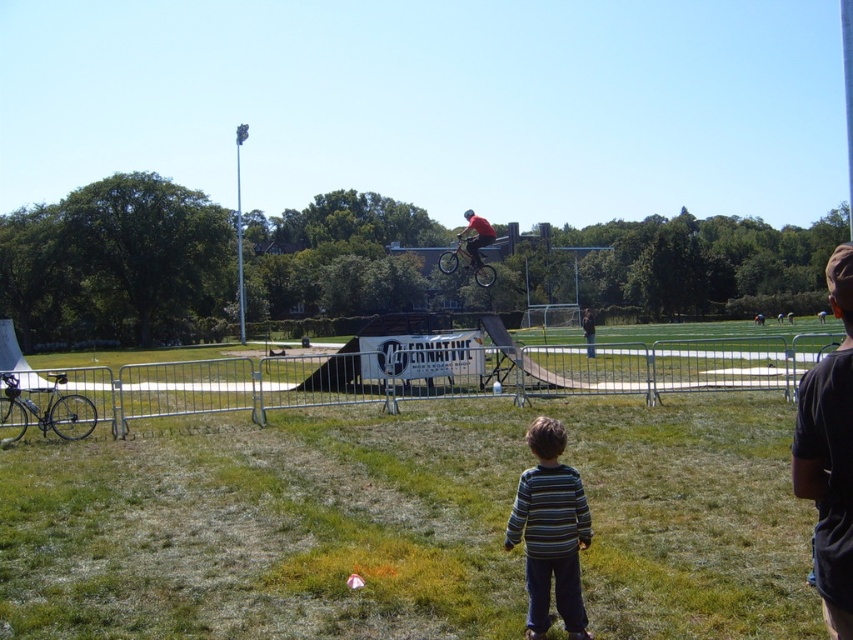
Question: Which of the following is the farthest from the observer?

Choices:
 (A) striped sweater at center
 (B) black cotton shirt at right

Answer: (A)

Question: Is shiny metallic bicycle at center to the left of red matte bicycle at center from the viewer's perspective?

Choices:
 (A) yes
 (B) no

Answer: (B)

Question: Can you confirm if shiny silver bicycle at lower left is positioned above shiny metallic bicycle at center?

Choices:
 (A) yes
 (B) no

Answer: (B)

Question: Which of these objects is positioned closest to the shiny silver bicycle at lower left?

Choices:
 (A) red matte bicycle at center
 (B) striped sweater at center
 (C) shiny metallic bicycle at center

Answer: (A)

Question: Estimate the real-world distances between objects in this image. Which object is farther from the striped sweater at center?

Choices:
 (A) black cotton shirt at right
 (B) red matte bicycle at center

Answer: (B)

Question: Does black cotton shirt at right come in front of shiny metallic bicycle at center?

Choices:
 (A) no
 (B) yes

Answer: (B)